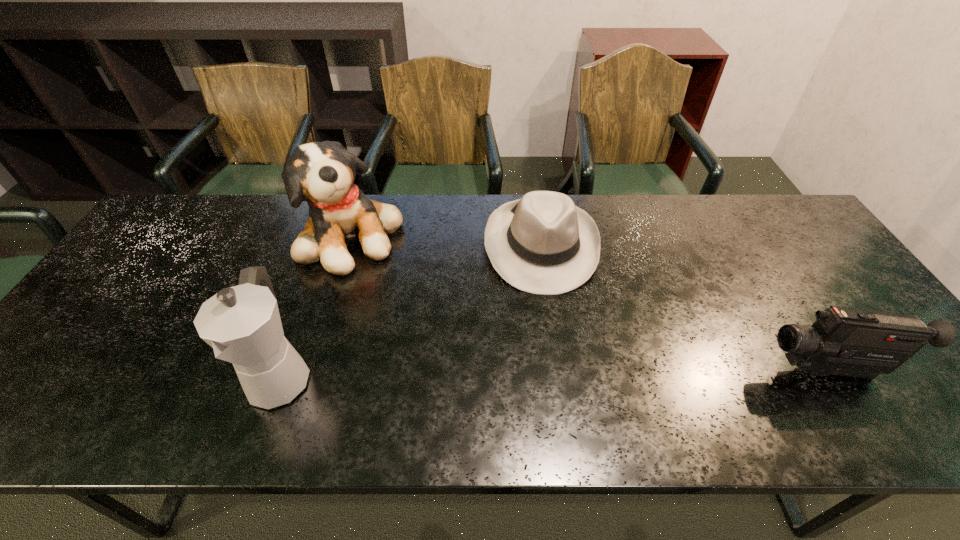
Identify the location of vacant area situated 0.250m on the front-facing side of the second object from right to left. (560, 378).

Locate an element on the screen. This screenshot has width=960, height=540. free space located 0.170m on the front-facing side of the second object from right to left is located at coordinates (556, 348).

Where is `vacant space located 0.290m on the front-facing side of the second object from right to left`? vacant space located 0.290m on the front-facing side of the second object from right to left is located at coordinates (562, 394).

The height and width of the screenshot is (540, 960). I want to click on vacant region located 0.220m at the face of the puppy, so click(434, 307).

You are a GUI agent. You are given a task and a screenshot of the screen. Output one action in this format:
    pyautogui.click(x=<x>, y=<y>)
    Task: Click on the free location located 0.110m at the face of the puppy
    The height and width of the screenshot is (540, 960).
    Given the screenshot: What is the action you would take?
    pyautogui.click(x=407, y=285)

The image size is (960, 540). What are the coordinates of `free point located at the face of the puppy` in the screenshot? It's located at (421, 297).

Find the location of a particular element. Image resolution: width=960 pixels, height=540 pixels. fedora present at the far edge is located at coordinates (542, 243).

Find the location of a particular element. The width and height of the screenshot is (960, 540). puppy that is positioned at the far edge is located at coordinates (322, 173).

This screenshot has height=540, width=960. What are the coordinates of `coffeepot that is positioned at the near edge` in the screenshot? It's located at (242, 324).

Identify the location of camcorder located at the near edge. (851, 342).